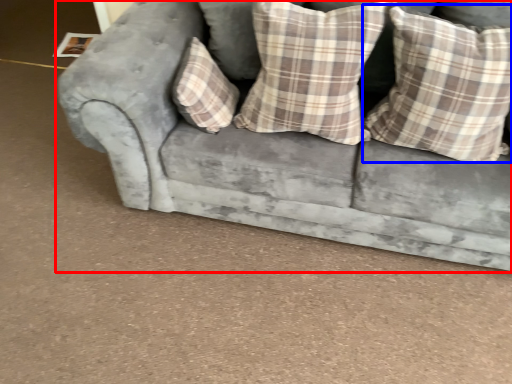
Question: Which of the following is the closest to the observer, studio couch (highlighted by a red box) or pillow (highlighted by a blue box)?

Choices:
 (A) studio couch
 (B) pillow

Answer: (A)